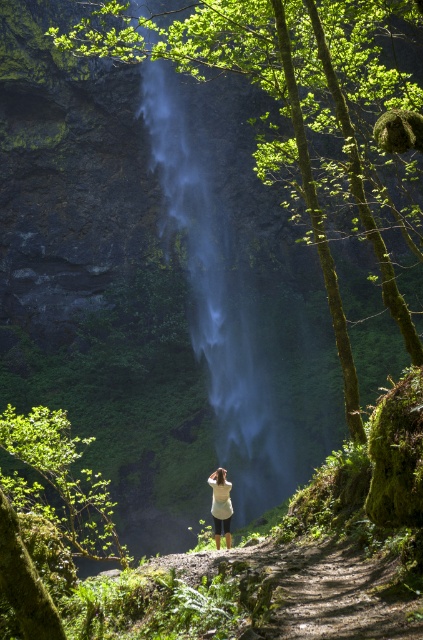
Question: In this image, where is translucent misty waterfall at center located relative to white matte shirt at center?

Choices:
 (A) left
 (B) right

Answer: (A)

Question: Can you confirm if translucent misty waterfall at center is positioned below white matte shirt at center?

Choices:
 (A) no
 (B) yes

Answer: (A)

Question: Does translucent misty waterfall at center have a larger size compared to white matte shirt at center?

Choices:
 (A) yes
 (B) no

Answer: (A)

Question: Which point is farther from the camera taking this photo?

Choices:
 (A) (142, 90)
 (B) (219, 525)

Answer: (A)